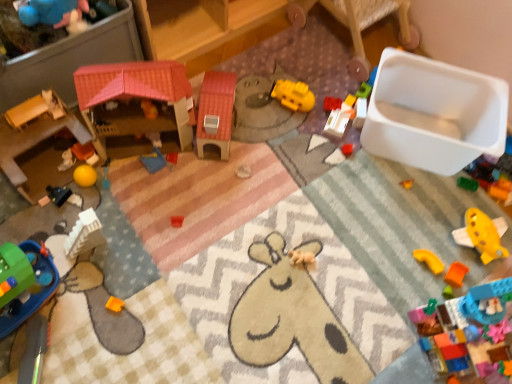
Where is `free space behind orange matte block at lower right, which ranks as the second toy in right-to-left order`? The image size is (512, 384). free space behind orange matte block at lower right, which ranks as the second toy in right-to-left order is located at coordinates (445, 232).